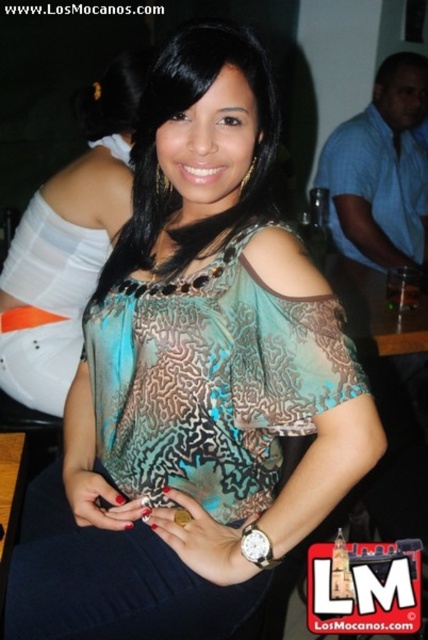
What do you see at coordinates (68, 246) in the screenshot? I see `matte teal blouse at center` at bounding box center [68, 246].

Identify the location of matte teal blouse at center. This screenshot has height=640, width=428. (68, 246).

What are the coordinates of `matte teal blouse at center` in the screenshot? It's located at (68, 246).

I want to click on matte teal blouse at center, so click(68, 246).